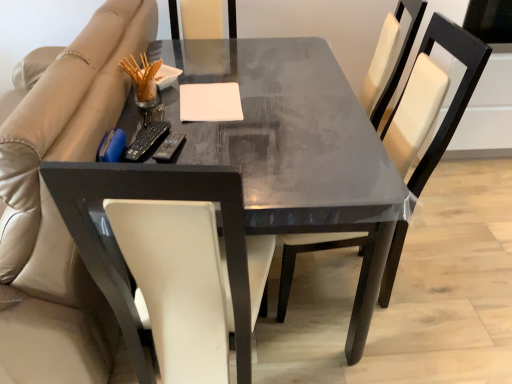
This screenshot has height=384, width=512. I want to click on unoccupied region to the right of white leather chair at center, so click(447, 295).